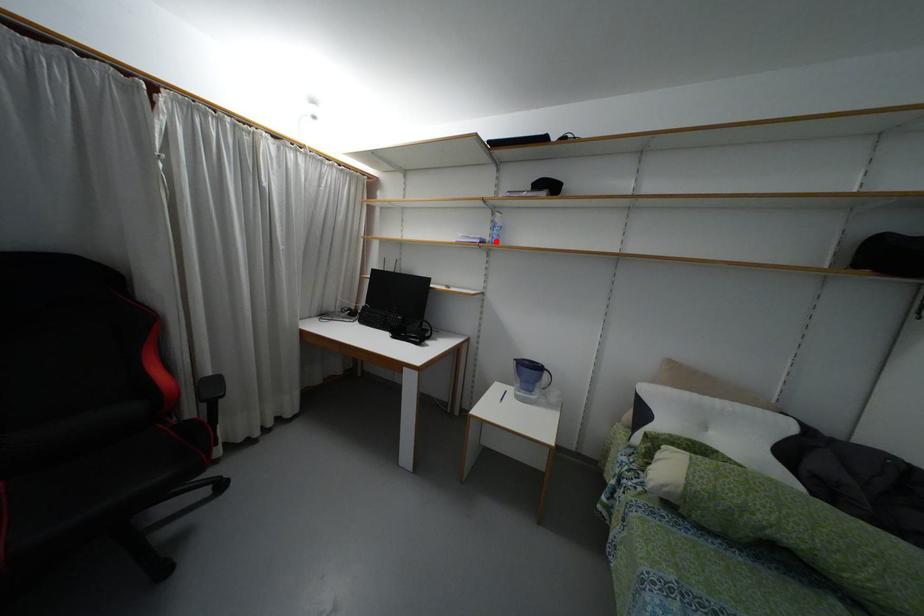
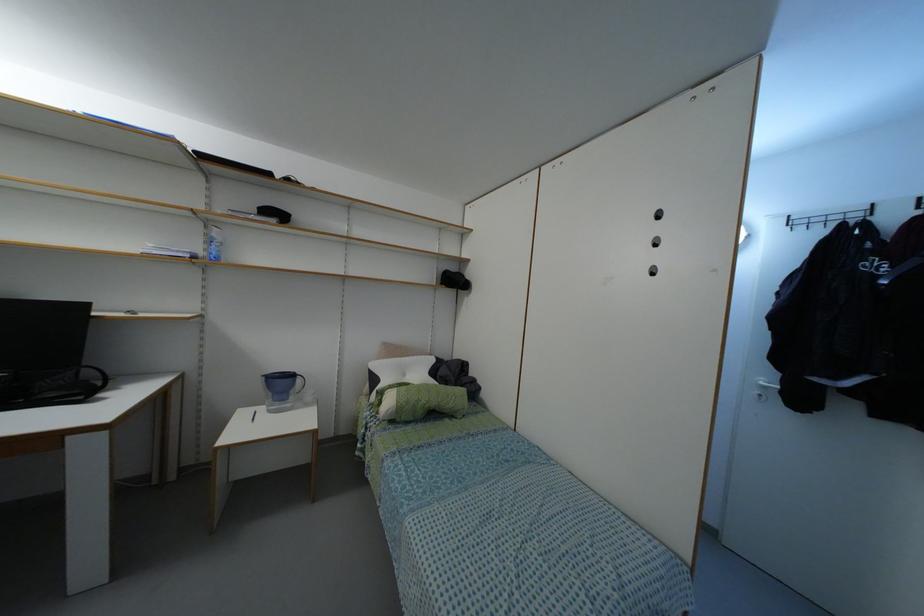
In the second image, find the point that corresponds to the highlighted location in the first image.

(216, 257)